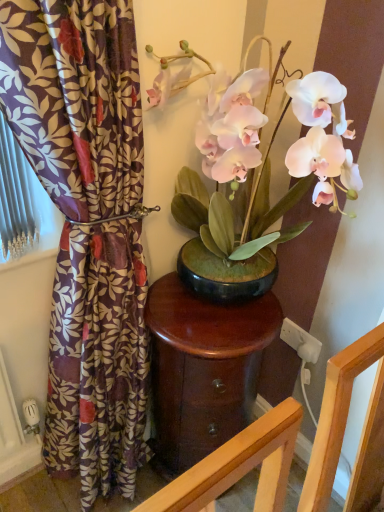
What are the coordinates of `vacant point above glossy wood table at center (from a real-world perspective)` in the screenshot? It's located at (215, 313).